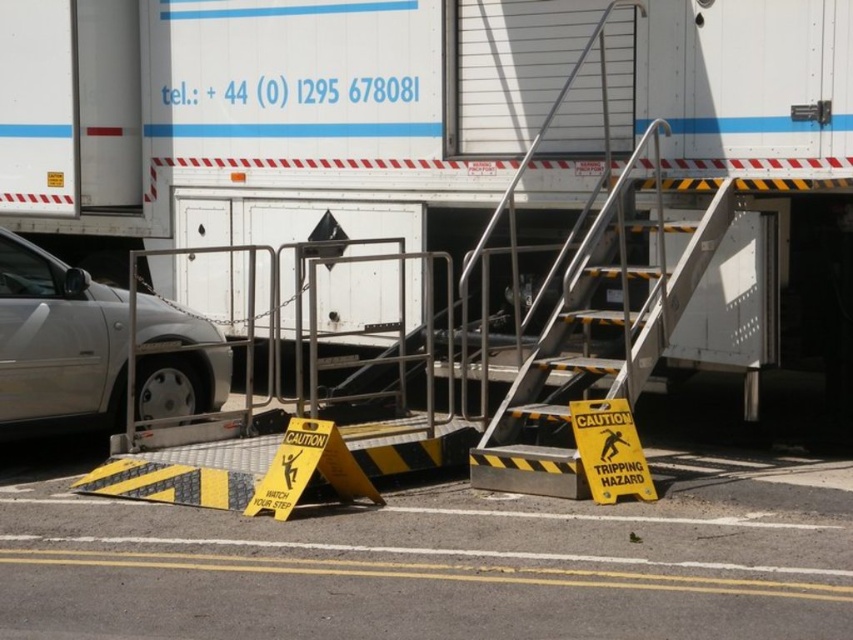
A delivery driver needs to place two yellow plastic caution signs so they are exactly 5 feet apart. They have the yellow plastic caution sign at center and the yellow plastic caution sign at lower center. Based on the scene, can they achieve this requirement?

The yellow plastic caution sign at center is 5.17 feet away from the yellow plastic caution sign at lower center. Since 5.17 feet is slightly more than 5 feet, the driver cannot achieve the exact 5 feet requirement between them.

Looking at this image, you are a delivery driver who needs to park your vehicle in this area. You see the white matte truck at center and the silver metallic car at left. Which vehicle is positioned higher in the image?

The white matte truck at center is located above the silver metallic car at left, so it is positioned higher in the image.